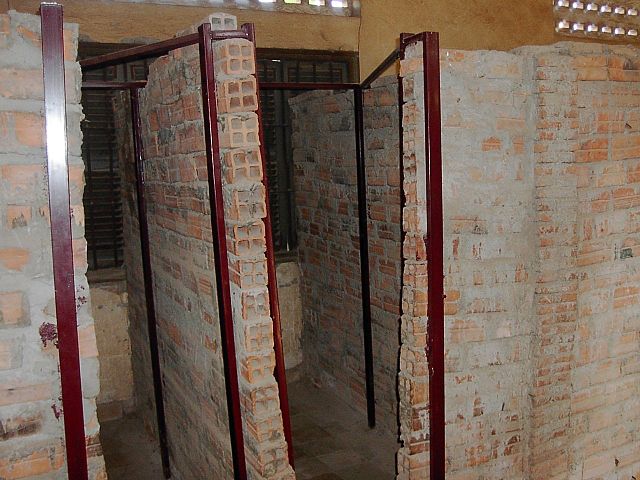
At what (x,y) coordinates should I click in order to perform the action: click on blinds. Please return your answer as a coordinate pair (x, y). The height and width of the screenshot is (480, 640). Looking at the image, I should click on (100, 207), (282, 230).